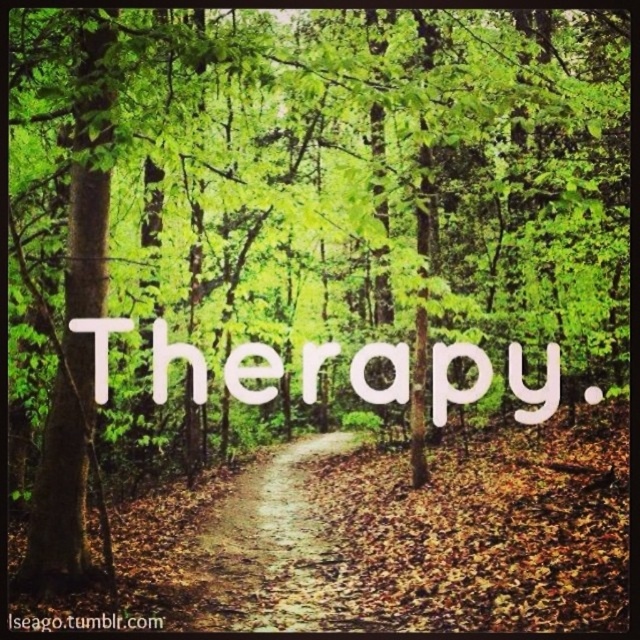
Can you confirm if white paper text at center is thinner than white matte text at center?

Incorrect, white paper text at center's width is not less than white matte text at center's.

Is white paper text at center to the right of white matte text at center from the viewer's perspective?

Indeed, white paper text at center is positioned on the right side of white matte text at center.

Identify the location of white paper text at center. This screenshot has height=640, width=640. (449, 381).

This screenshot has width=640, height=640. In order to click on white paper text at center in this screenshot , I will do `click(449, 381)`.

Does brown dirt path at center lie in front of white matte text at center?

No, it is not.

Is brown dirt path at center shorter than white matte text at center?

Indeed, brown dirt path at center has a lesser height compared to white matte text at center.

Is point (253, 534) farther from viewer compared to point (131, 616)?

That is True.

Locate an element on the screen. This screenshot has height=640, width=640. brown dirt path at center is located at coordinates (266, 548).

Between brown dirt path at center and white paper text at center, which one is positioned lower?

brown dirt path at center is lower down.

Which is in front, point (346, 442) or point (467, 348)?

Point (467, 348)

Is point (264, 563) less distant than point (316, 381)?

No.

At what (x,y) coordinates should I click in order to perform the action: click on brown dirt path at center. Please return your answer as a coordinate pair (x, y). The image size is (640, 640). Looking at the image, I should click on (266, 548).